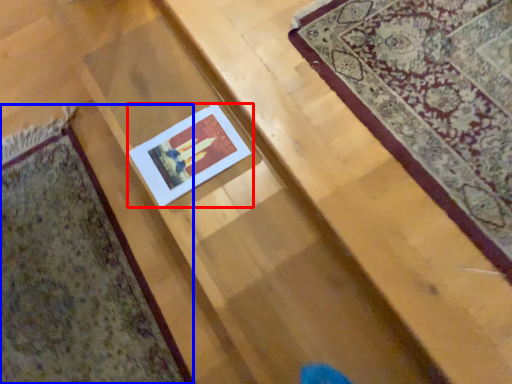
Question: Which of the following is the closest to the observer, picture frame (highlighted by a red box) or mat (highlighted by a blue box)?

Choices:
 (A) picture frame
 (B) mat

Answer: (B)